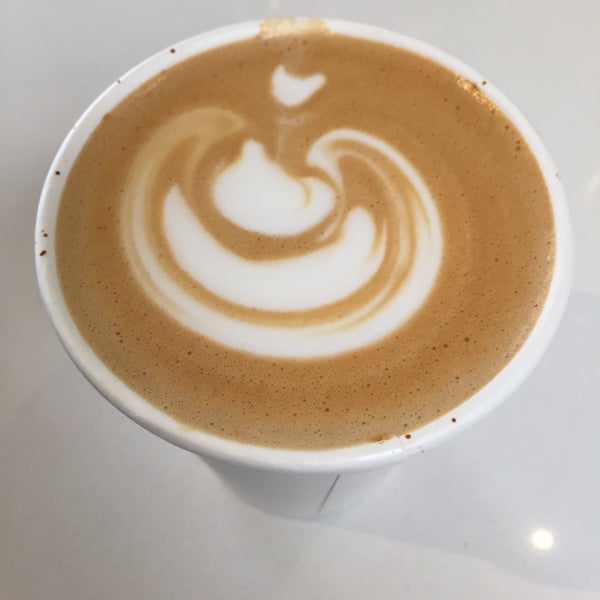
Where is `foam`? The image size is (600, 600). foam is located at coordinates pyautogui.click(x=429, y=402), pyautogui.click(x=260, y=430), pyautogui.click(x=91, y=312).